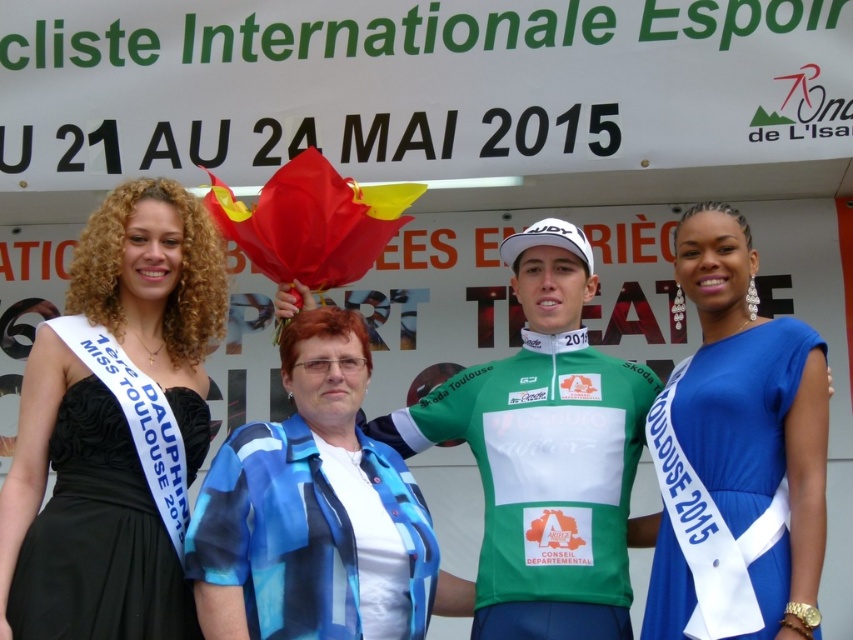
You are a photographer standing at the camera position. You want to adjust your lens to focus on the green jersey at center. What is the approximate distance you need to set your lens to?

The green jersey at center and camera are 96.13 feet apart, so you should set your lens to approximately 96 feet to focus on the green jersey at center.

You are standing in front of the backdrop of the Cycliste Internationale Espoir event. There are two points marked on the backdrop. The first point is at coordinates point [74,420] and the second is at point [238,593]. From your perspective, which point appears closer to you?

Point [238,593] appears closer to you because the description states that point [74,420] is behind point [238,593].

You are organizing a photo shoot and need to position a light source at point 0.7, 0.85 to highlight the blue satin dress at center. According to the image, will the light source be positioned correctly to illuminate the dress?

The blue satin dress at center is located at point (x=737, y=452), so the light source at (x=724, y=448) is very close and should effectively illuminate the dress.